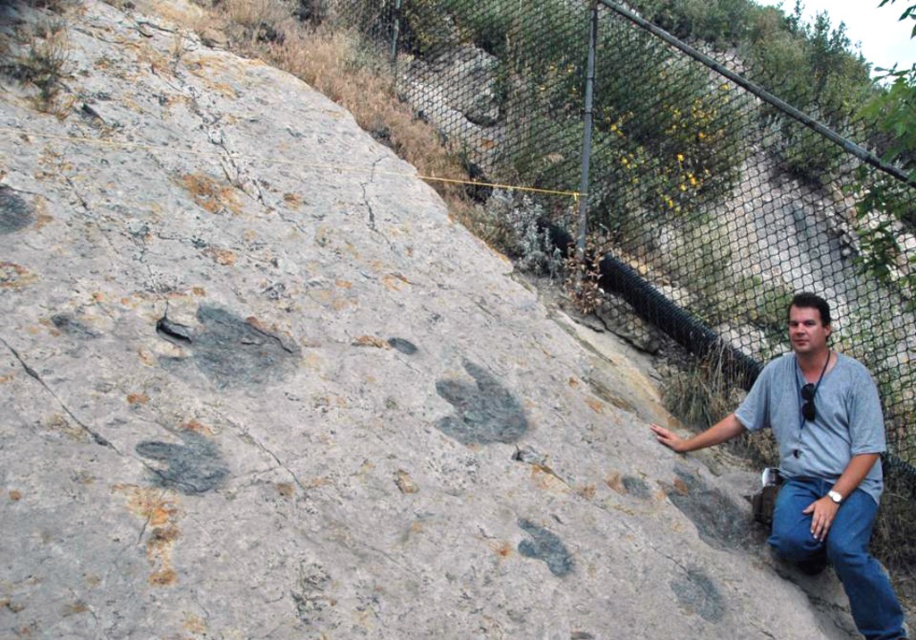
Question: Which of the following is the closest to the observer?

Choices:
 (A) metal mesh fence at upper right
 (B) gray cotton shirt at lower right

Answer: (B)

Question: Which point is farther to the camera?

Choices:
 (A) metal mesh fence at upper right
 (B) gray cotton shirt at lower right

Answer: (A)

Question: Can you confirm if metal mesh fence at upper right is bigger than gray cotton shirt at lower right?

Choices:
 (A) no
 (B) yes

Answer: (A)

Question: Can you confirm if metal mesh fence at upper right is positioned to the right of gray cotton shirt at lower right?

Choices:
 (A) no
 (B) yes

Answer: (A)

Question: Is metal mesh fence at upper right further to camera compared to gray cotton shirt at lower right?

Choices:
 (A) yes
 (B) no

Answer: (A)